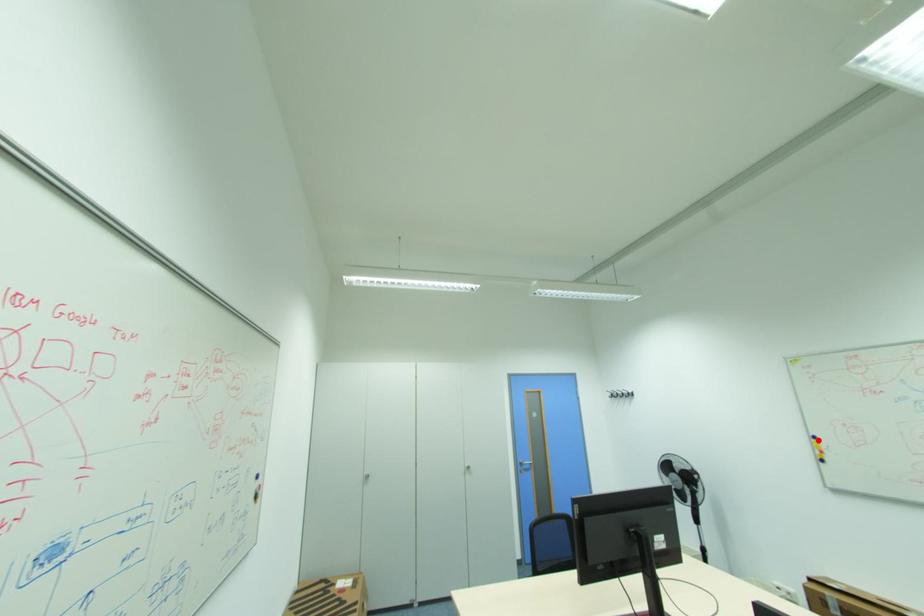
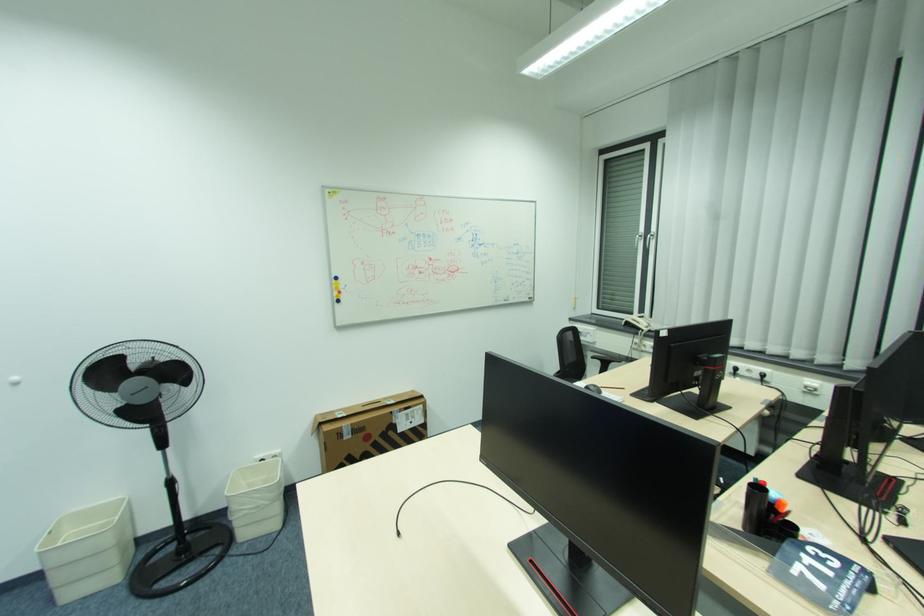
Locate, in the second image, the point that corresponds to the highlighted location in the first image.

(339, 282)